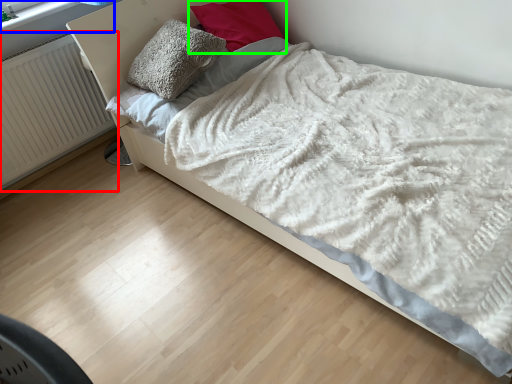
Question: Which object is positioned closest to radiator (highlighted by a red box)? Select from window frame (highlighted by a blue box) and pillow (highlighted by a green box).

Choices:
 (A) window frame
 (B) pillow

Answer: (A)